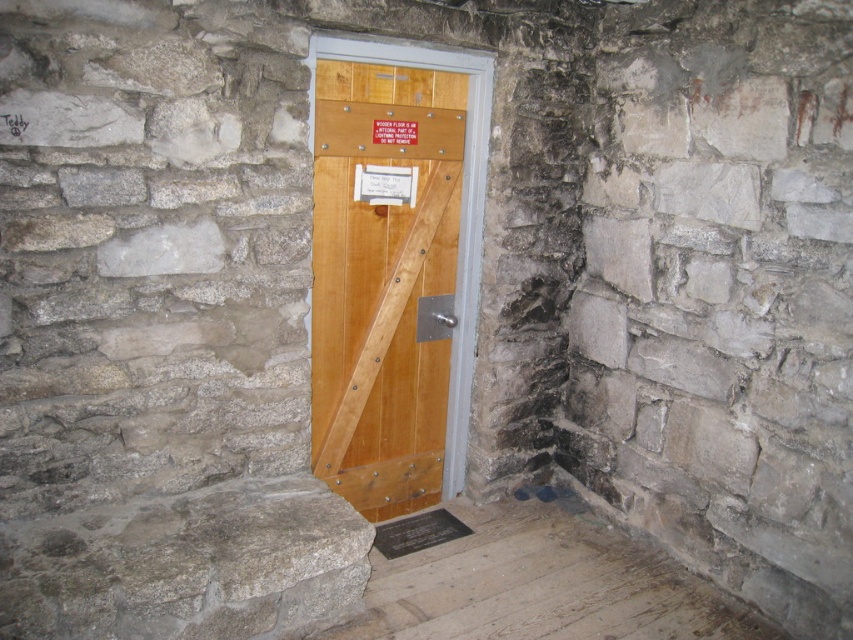
You are standing in the rustic interior space and want to walk towards the wooden floor at lower center. Which direction should you move relative to the wooden door at center?

The wooden door at center is to the left of the wooden floor at lower center, so you should move to the right to reach the wooden floor at lower center.

Based on the photo, you are a delivery person trying to deliver a package to the wooden door at center. There is a wooden sign at center in the way. Can you reach the door without moving the sign?

The wooden door at center and wooden sign at center are 34.30 centimeters apart from each other. Since the sign is directly in front of the door, you would need to move it to access the door.